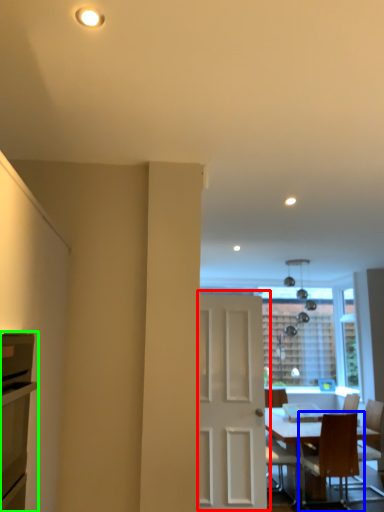
Question: Which is nearer to the door (highlighted by a red box)? chair (highlighted by a blue box) or cabinetry (highlighted by a green box).

Choices:
 (A) chair
 (B) cabinetry

Answer: (A)